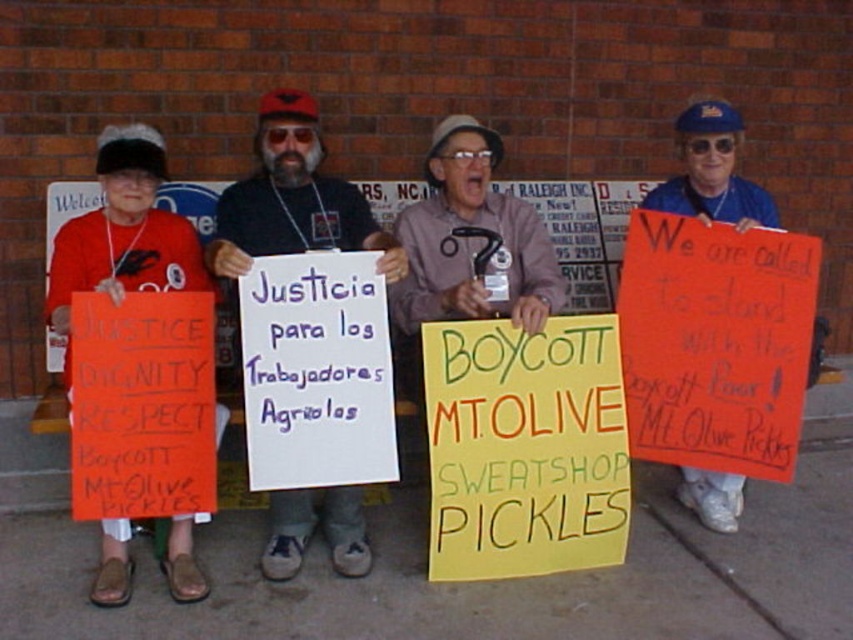
Question: Is yellow paper sign at center in front of white paper at center?

Choices:
 (A) no
 (B) yes

Answer: (A)

Question: Does black fabric shirt at center have a larger size compared to blue fabric cap at upper right?

Choices:
 (A) yes
 (B) no

Answer: (A)

Question: Is concrete pavement at lower center to the right of orange fabric sign at left from the viewer's perspective?

Choices:
 (A) yes
 (B) no

Answer: (A)

Question: Estimate the real-world distances between objects in this image. Which object is closer to the yellow paper sign at center?

Choices:
 (A) orange fabric sign at left
 (B) black fabric shirt at center
 (C) concrete pavement at lower center

Answer: (C)

Question: Among these points, which one is farthest from the camera?

Choices:
 (A) (701, 499)
 (B) (125, 560)

Answer: (A)

Question: Which object is the closest to the white paper at center?

Choices:
 (A) yellow paper sign at center
 (B) black fabric shirt at center
 (C) orange fabric sign at left
 (D) blue fabric cap at upper right

Answer: (B)